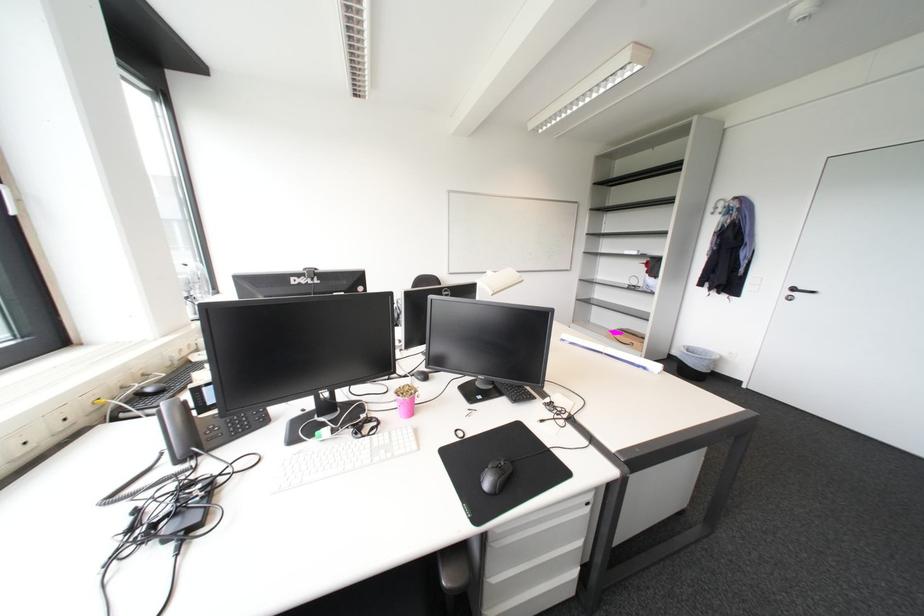
Locate an element on the screen. This screenshot has width=924, height=616. telephone handset is located at coordinates (178, 430).